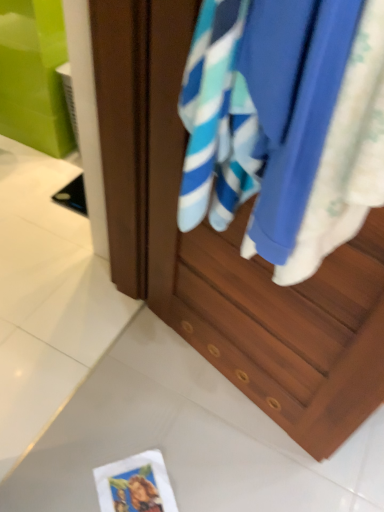
I want to click on vacant space underneath white paper postcard at lower center (from a real-world perspective), so click(142, 490).